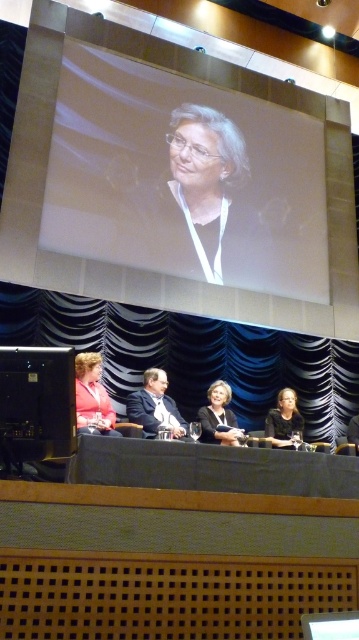
Between matte pink shirt at lower left and matte black jacket at center, which one appears on the left side from the viewer's perspective?

From the viewer's perspective, matte pink shirt at lower left appears more on the left side.

Does matte pink shirt at lower left have a lesser height compared to matte black jacket at center?

No.

Is point (77, 397) positioned behind point (198, 417)?

That is False.

Where is `matte pink shirt at lower left`? matte pink shirt at lower left is located at coordinates (92, 397).

Between matte black jacket at center and matte black hair at lower right, which one has more height?

With more height is matte black jacket at center.

Is point (215, 388) less distant than point (286, 436)?

No, it is behind (286, 436).

Who is more distant from viewer, (x=221, y=400) or (x=277, y=397)?

The point (x=277, y=397) is more distant.

Find the location of `matte black jacket at center`. matte black jacket at center is located at coordinates (218, 417).

What are the coordinates of `matte black suit at center` in the screenshot? It's located at (155, 406).

Is point (157, 369) more distant than point (280, 412)?

No, (157, 369) is closer to viewer.

You are a GUI agent. You are given a task and a screenshot of the screen. Output one action in this format:
    pyautogui.click(x=<x>, y=<y>)
    Task: Click on the matte black suit at center
    The width and height of the screenshot is (359, 640).
    Given the screenshot: What is the action you would take?
    pyautogui.click(x=155, y=406)

At what (x,y) coordinates should I click in order to perform the action: click on matte black suit at center. Please return your answer as a coordinate pair (x, y). Looking at the image, I should click on (155, 406).